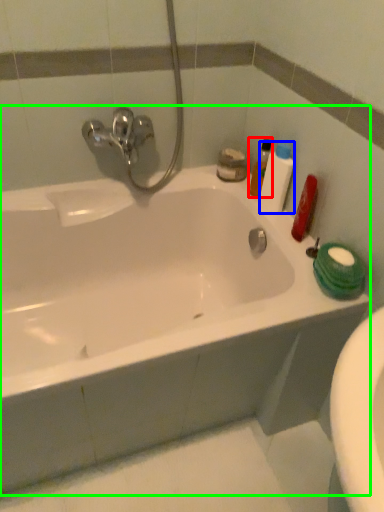
Question: Estimate the real-world distances between objects in this image. Which object is farther from cleaning product (highlighted by a red box), toiletry (highlighted by a blue box) or bathtub (highlighted by a green box)?

Choices:
 (A) toiletry
 (B) bathtub

Answer: (B)